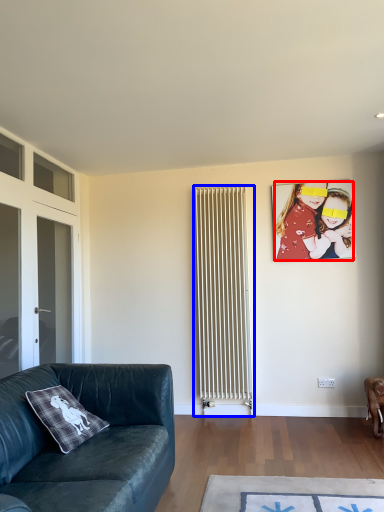
Question: Which object appears closest to the camera in this image, person (highlighted by a red box) or radiator (highlighted by a blue box)?

Choices:
 (A) person
 (B) radiator

Answer: (B)